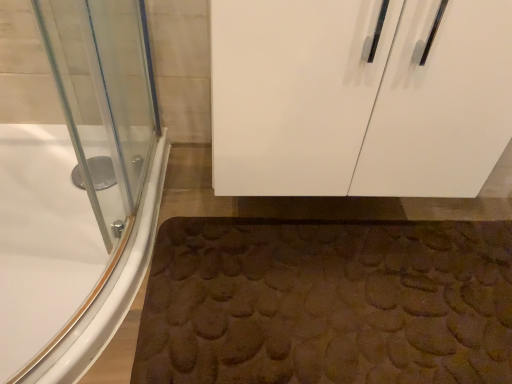
Question: From the image's perspective, is white glossy bathtub at lower left over white glossy cabinet at upper center?

Choices:
 (A) yes
 (B) no

Answer: (B)

Question: Is white glossy bathtub at lower left not inside white glossy cabinet at upper center?

Choices:
 (A) yes
 (B) no

Answer: (A)

Question: Is white glossy bathtub at lower left positioned before white glossy cabinet at upper center?

Choices:
 (A) no
 (B) yes

Answer: (A)

Question: Is white glossy bathtub at lower left smaller than white glossy cabinet at upper center?

Choices:
 (A) no
 (B) yes

Answer: (B)

Question: From a real-world perspective, is white glossy bathtub at lower left beneath white glossy cabinet at upper center?

Choices:
 (A) yes
 (B) no

Answer: (A)

Question: From the image's perspective, is white glossy bathtub at lower left located beneath white glossy cabinet at upper center?

Choices:
 (A) yes
 (B) no

Answer: (A)

Question: Is white glossy cabinet at upper center positioned in front of white glossy bathtub at lower left?

Choices:
 (A) yes
 (B) no

Answer: (A)

Question: Is white glossy cabinet at upper center next to white glossy bathtub at lower left and touching it?

Choices:
 (A) no
 (B) yes

Answer: (A)

Question: From a real-world perspective, is white glossy cabinet at upper center located beneath white glossy bathtub at lower left?

Choices:
 (A) no
 (B) yes

Answer: (A)

Question: Is white glossy cabinet at upper center positioned beyond the bounds of white glossy bathtub at lower left?

Choices:
 (A) yes
 (B) no

Answer: (A)

Question: Can white glossy bathtub at lower left be found inside white glossy cabinet at upper center?

Choices:
 (A) yes
 (B) no

Answer: (B)

Question: Is white glossy cabinet at upper center wider than white glossy bathtub at lower left?

Choices:
 (A) no
 (B) yes

Answer: (B)

Question: Is white glossy cabinet at upper center closer to camera compared to brown textured bath mat at lower center?

Choices:
 (A) no
 (B) yes

Answer: (B)